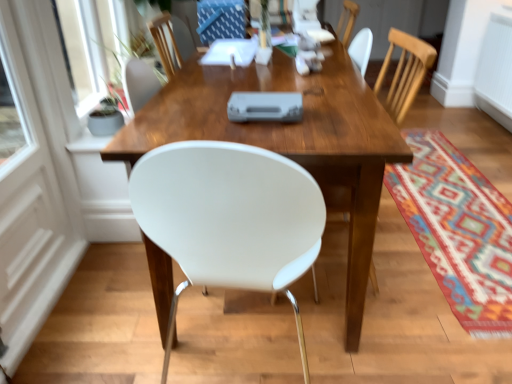
Question: Is wooden table at center surrounding white glossy door at left?

Choices:
 (A) no
 (B) yes

Answer: (A)

Question: Is wooden table at center outside white glossy door at left?

Choices:
 (A) no
 (B) yes

Answer: (B)

Question: Can you confirm if wooden table at center is positioned to the left of white glossy door at left?

Choices:
 (A) yes
 (B) no

Answer: (B)

Question: From a real-world perspective, is wooden table at center on top of white glossy door at left?

Choices:
 (A) no
 (B) yes

Answer: (A)

Question: Could you tell me if wooden table at center is turned towards white glossy door at left?

Choices:
 (A) yes
 (B) no

Answer: (B)

Question: Can you confirm if wooden table at center is bigger than white glossy door at left?

Choices:
 (A) no
 (B) yes

Answer: (B)

Question: Can white glossy door at left be found inside multicolored woven mat at lower right?

Choices:
 (A) no
 (B) yes

Answer: (A)

Question: Is multicolored woven mat at lower right oriented away from white glossy door at left?

Choices:
 (A) no
 (B) yes

Answer: (A)

Question: From a real-world perspective, is multicolored woven mat at lower right physically above white glossy door at left?

Choices:
 (A) yes
 (B) no

Answer: (B)

Question: Are multicolored woven mat at lower right and white glossy door at left located far from each other?

Choices:
 (A) no
 (B) yes

Answer: (B)

Question: Is multicolored woven mat at lower right not within white glossy door at left?

Choices:
 (A) yes
 (B) no

Answer: (A)

Question: From a real-world perspective, is multicolored woven mat at lower right under white glossy door at left?

Choices:
 (A) no
 (B) yes

Answer: (B)

Question: Is white glossy door at left to the right of multicolored woven mat at lower right from the viewer's perspective?

Choices:
 (A) no
 (B) yes

Answer: (A)